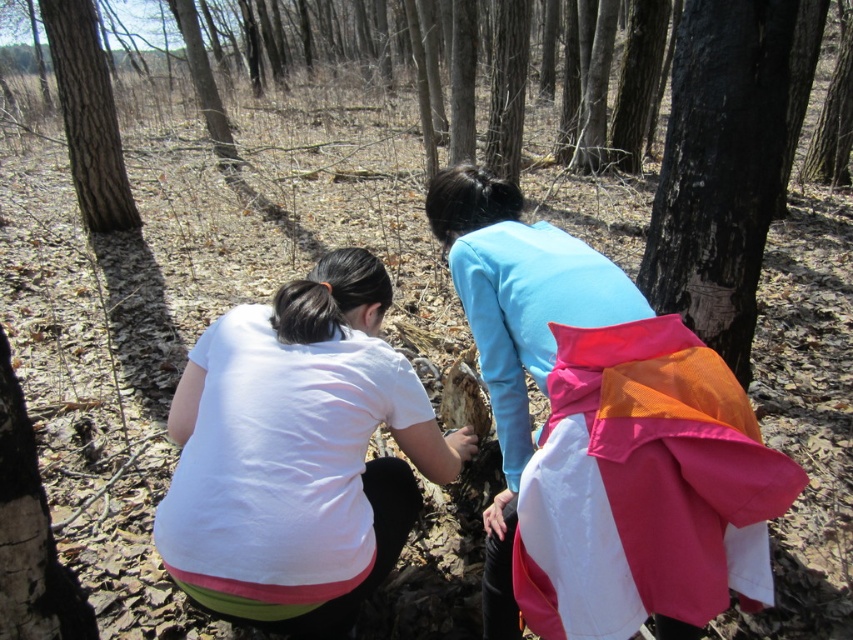
Question: Is white matte shirt at lower left bigger than black rough bark at center?

Choices:
 (A) yes
 (B) no

Answer: (A)

Question: Can you confirm if white matte shirt at lower left is positioned above black rough bark at center?

Choices:
 (A) no
 (B) yes

Answer: (A)

Question: Which of these objects is positioned closest to the white matte shirt at lower left?

Choices:
 (A) black rough bark at center
 (B) rough bark tree at upper left

Answer: (A)

Question: Estimate the real-world distances between objects in this image. Which object is farther from the white matte shirt at lower left?

Choices:
 (A) rough bark tree at upper left
 (B) black rough bark at center

Answer: (A)

Question: Among these points, which one is farthest from the camera?

Choices:
 (A) (131, 205)
 (B) (238, 371)
 (C) (648, 298)

Answer: (A)

Question: In this image, where is black rough bark at center located relative to rough bark tree at upper left?

Choices:
 (A) left
 (B) right

Answer: (B)